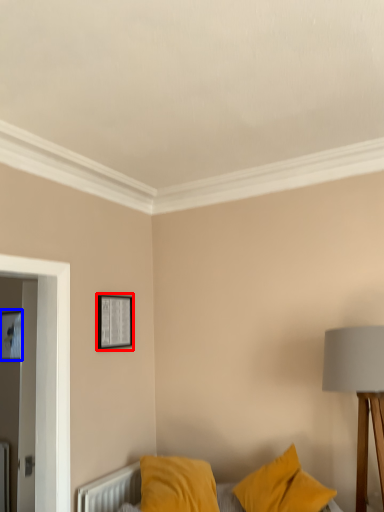
Question: Which object appears closest to the camera in this image, picture frame (highlighted by a red box) or picture frame (highlighted by a blue box)?

Choices:
 (A) picture frame
 (B) picture frame

Answer: (A)